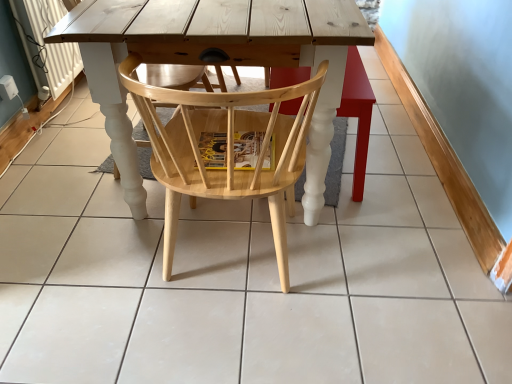
The width and height of the screenshot is (512, 384). Identify the location of blank space to the left of natural wood chair at center. (94, 264).